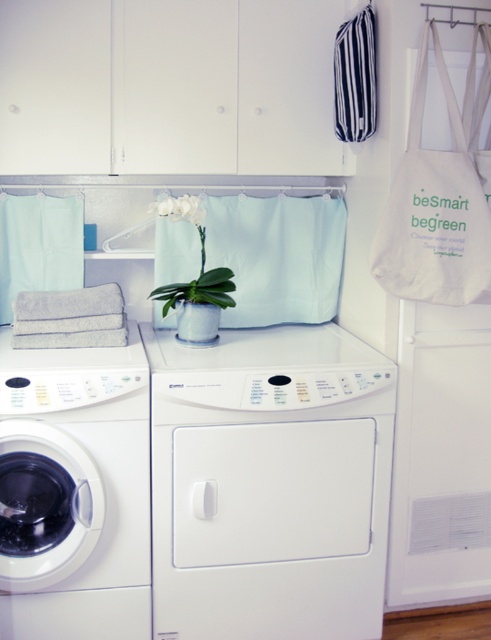
Question: Which point is farther to the camera?

Choices:
 (A) white matte orchid at center
 (B) mint fabric laundry at upper center
 (C) white glossy washing machine at left
 (D) gray terry towel at center

Answer: (B)

Question: Considering the relative positions of white matte dryer at center and mint fabric laundry at upper center in the image provided, where is white matte dryer at center located with respect to mint fabric laundry at upper center?

Choices:
 (A) below
 (B) above

Answer: (A)

Question: Estimate the real-world distances between objects in this image. Which object is farther from the white glossy washing machine at left?

Choices:
 (A) mint fabric laundry at upper center
 (B) striped fabric laundry bag at upper right

Answer: (B)

Question: Does white glossy washing machine at left have a greater width compared to white matte orchid at center?

Choices:
 (A) yes
 (B) no

Answer: (A)

Question: Which of the following is the farthest from the observer?

Choices:
 (A) (92, 452)
 (B) (47, 340)

Answer: (B)

Question: Does mint fabric laundry at upper center have a greater width compared to white matte orchid at center?

Choices:
 (A) no
 (B) yes

Answer: (B)